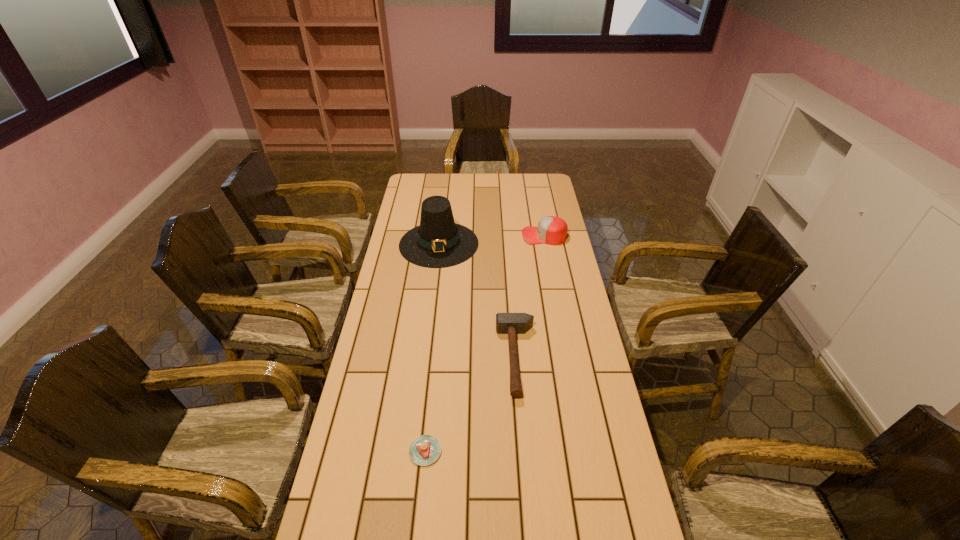
The height and width of the screenshot is (540, 960). In order to click on unoccupied position between the pastry and the third tallest object in this screenshot , I will do `click(471, 404)`.

Where is `free space that is in between the nearest object and the second tallest object`? The width and height of the screenshot is (960, 540). free space that is in between the nearest object and the second tallest object is located at coordinates (485, 343).

Identify the location of free space that is in between the hammer and the baseball cap. The image size is (960, 540). (531, 297).

Identify the location of empty location between the tallest object and the second tallest object. This screenshot has height=540, width=960. pyautogui.click(x=492, y=240).

The width and height of the screenshot is (960, 540). I want to click on vacant point located between the hammer and the hat, so [478, 301].

Locate an element on the screen. empty space between the hat and the third farthest object is located at coordinates (478, 301).

In order to click on free spot between the second shortest object and the tallest object in this screenshot , I will do `click(478, 301)`.

The height and width of the screenshot is (540, 960). Identify the location of vacant space in between the third shortest object and the hat. (492, 240).

Identify which object is the closest to the baseball cap. Please provide its 2D coordinates. Your answer should be formatted as a tuple, i.e. [(x, y)], where the tuple contains the x and y coordinates of a point satisfying the conditions above.

[(438, 242)]

Identify which object is located as the second nearest to the baseball cap. Please provide its 2D coordinates. Your answer should be formatted as a tuple, i.e. [(x, y)], where the tuple contains the x and y coordinates of a point satisfying the conditions above.

[(506, 323)]